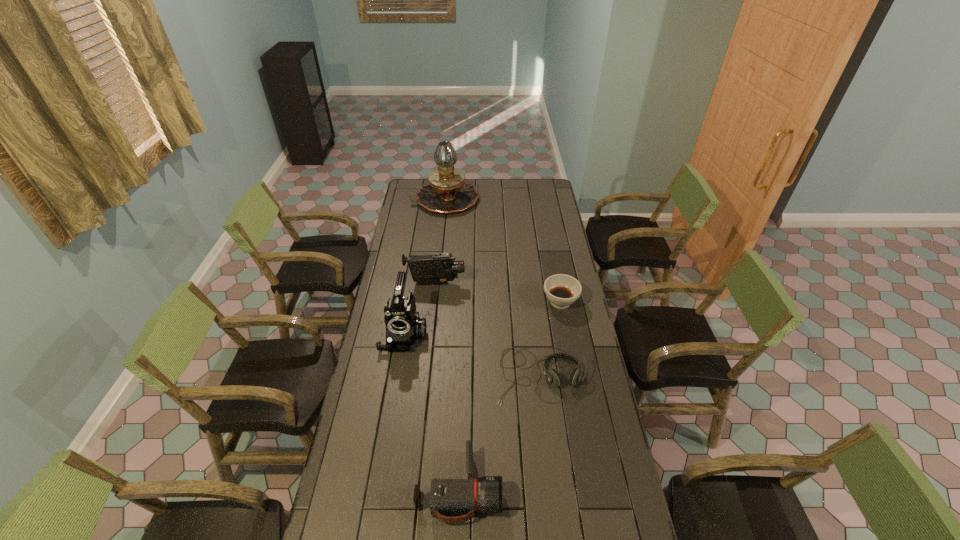
The height and width of the screenshot is (540, 960). What are the coordinates of `object that is at the far left corner` in the screenshot? It's located at (447, 192).

Locate an element on the screen. blank space at the far edge of the desktop is located at coordinates (498, 198).

In the image, there is a desktop. Where is `free space at the left edge`? free space at the left edge is located at coordinates (411, 285).

I want to click on vacant area at the right edge of the desktop, so coord(565,249).

Identify the location of free point at the far left corner. The height and width of the screenshot is (540, 960). (420, 184).

The height and width of the screenshot is (540, 960). Identify the location of vacant point at the far right corner. (543, 181).

Find the location of a particular element. The width and height of the screenshot is (960, 540). empty location between the nearest object and the headset is located at coordinates (500, 431).

Image resolution: width=960 pixels, height=540 pixels. Identify the location of vacant area between the tallest camcorder and the headset. (472, 354).

Where is `free space that is in between the oil lamp and the soup bowl`? The image size is (960, 540). free space that is in between the oil lamp and the soup bowl is located at coordinates (503, 251).

Where is `empty space between the tallest camcorder and the nearest object`? The height and width of the screenshot is (540, 960). empty space between the tallest camcorder and the nearest object is located at coordinates (432, 411).